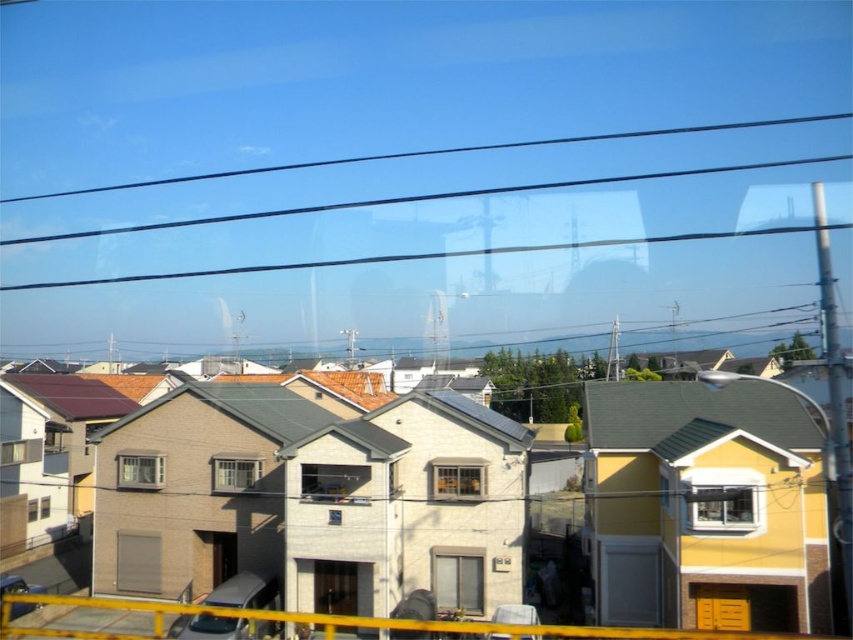
You are a window installer assessing two windows in the image. The first is the transparent glass window at center and the second is the clear glass window at center. Which window has a smaller height?

The transparent glass window at center has a lesser height compared to the clear glass window at center, so the transparent glass window at center is smaller in height.

You are standing in front of two windows, the transparent glass window at center and the matte glass window at center. Which one is positioned to the right side?

The transparent glass window at center is positioned to the right of the matte glass window at center.